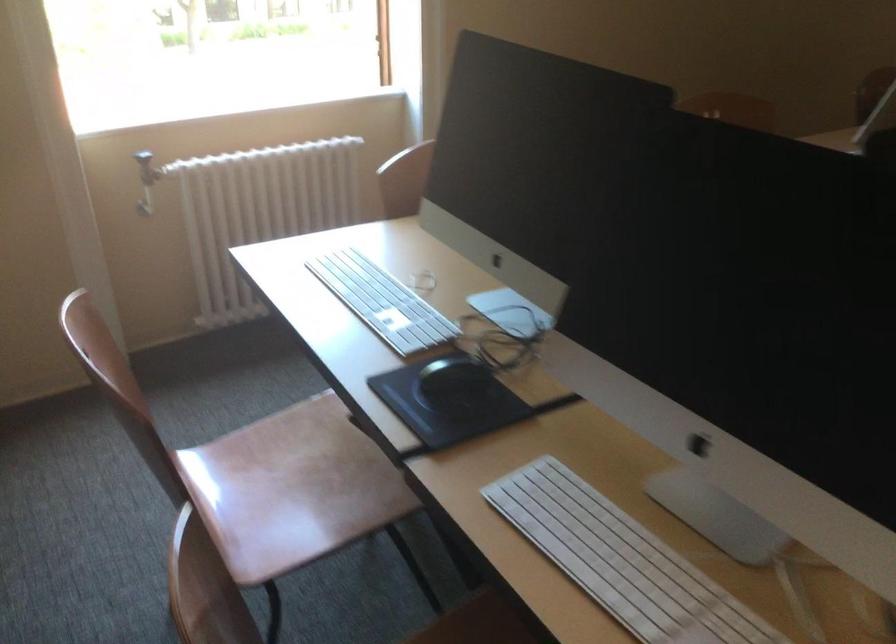
Where is `black circular dial`? black circular dial is located at coordinates (452, 383).